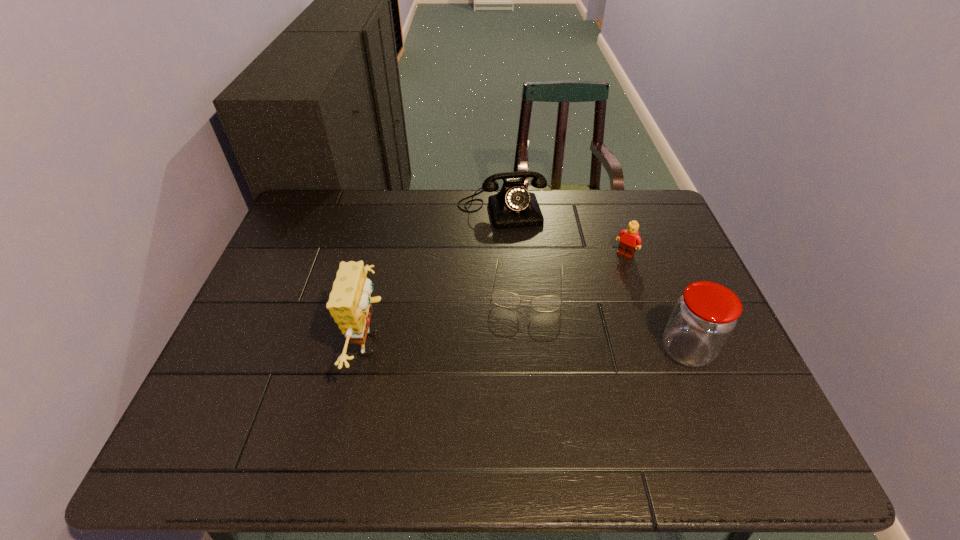
Identify the location of Lego at the right edge. (630, 241).

Where is `vacant space at the far edge of the desktop`? The height and width of the screenshot is (540, 960). vacant space at the far edge of the desktop is located at coordinates (372, 195).

Find the location of a particular element. Image resolution: width=960 pixels, height=540 pixels. vacant space at the near edge of the desktop is located at coordinates (485, 382).

This screenshot has width=960, height=540. Identify the location of vacant space at the left edge. (304, 268).

Where is `vacant area at the far left corner of the desktop`? The height and width of the screenshot is (540, 960). vacant area at the far left corner of the desktop is located at coordinates (315, 224).

Where is `vacant region at the near left corner of the desktop`? vacant region at the near left corner of the desktop is located at coordinates (254, 399).

Locate an element on the screen. The image size is (960, 540). free space at the far right corner of the desktop is located at coordinates click(x=654, y=201).

You are a GUI agent. You are given a task and a screenshot of the screen. Output one action in this format:
    pyautogui.click(x=<x>, y=<y>)
    Task: Click on the vacant point located between the shortest object and the second farthest object
    The width and height of the screenshot is (960, 540).
    Given the screenshot: What is the action you would take?
    pyautogui.click(x=576, y=271)

The image size is (960, 540). Identify the location of free space that is in between the telephone and the spectacles. (515, 247).

This screenshot has width=960, height=540. What are the coordinates of `vacant space that's between the tallest object and the second tallest object` in the screenshot? It's located at (529, 347).